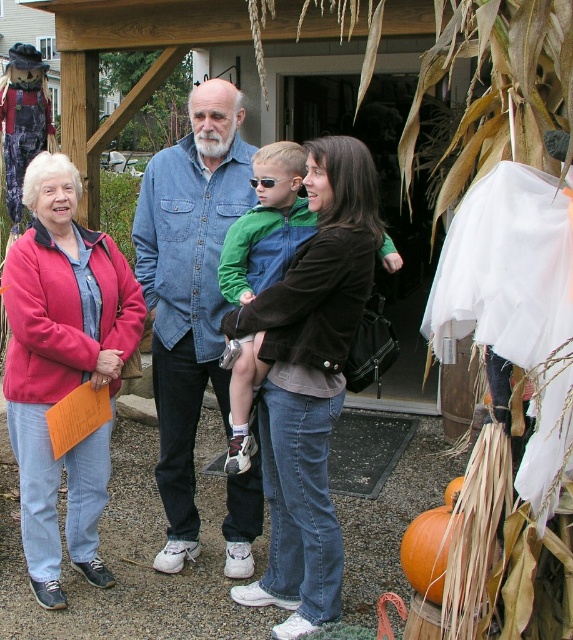
Question: In this image, where is denim shirt at center located relative to green denim jacket at center?

Choices:
 (A) above
 (B) below

Answer: (B)

Question: Which object appears farthest from the camera in this image?

Choices:
 (A) denim shirt at center
 (B) orange matte pumpkin at lower right
 (C) denim jacket at center
 (D) green denim jacket at center

Answer: (A)

Question: Which point is closer to the camera taking this photo?

Choices:
 (A) (190, 432)
 (B) (273, 180)
 (C) (96, 516)
 (D) (166, 488)

Answer: (B)

Question: Which point is closer to the camera?

Choices:
 (A) green denim jacket at center
 (B) orange matte pumpkin at lower right
 (C) matte brown jacket at center
 (D) denim jacket at center

Answer: (B)

Question: Is green denim jacket at center behind orange matte pumpkin at lower right?

Choices:
 (A) yes
 (B) no

Answer: (A)

Question: Does denim jacket at center have a lesser width compared to denim shirt at center?

Choices:
 (A) yes
 (B) no

Answer: (B)